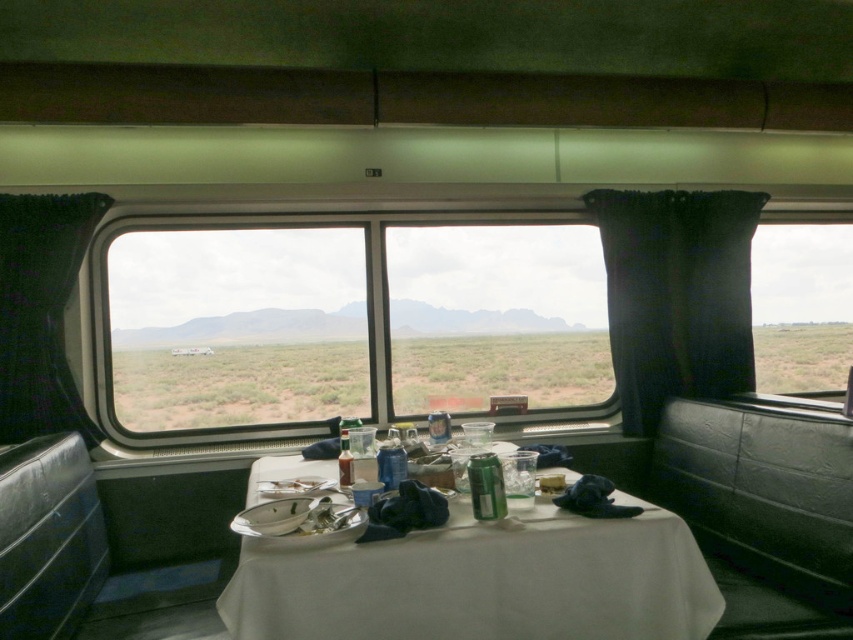
Which is more to the right, clear glass window at center or white cloth table at center?

white cloth table at center is more to the right.

Who is more forward, [428,272] or [252,627]?

Point [252,627] is in front.

The width and height of the screenshot is (853, 640). Find the location of `clear glass window at center`. clear glass window at center is located at coordinates (236, 326).

Which is behind, point (680, 365) or point (3, 208)?

Point (680, 365)

In the scene shown: Does black fabric curtain at right appear on the left side of green fabric curtain at left?

No, black fabric curtain at right is not to the left of green fabric curtain at left.

Which is behind, point (717, 376) or point (9, 349)?

Point (717, 376)

Identify the location of black fabric curtain at right. Image resolution: width=853 pixels, height=640 pixels. (676, 296).

Who is lower down, white cloth table at center or black fabric curtain at right?

white cloth table at center is lower down.

Which of these two, white cloth table at center or black fabric curtain at right, stands shorter?

Standing shorter between the two is white cloth table at center.

Does point (521, 540) come closer to viewer compared to point (693, 380)?

Yes, it is.

This screenshot has height=640, width=853. What are the coordinates of `white cloth table at center` in the screenshot? It's located at (483, 582).